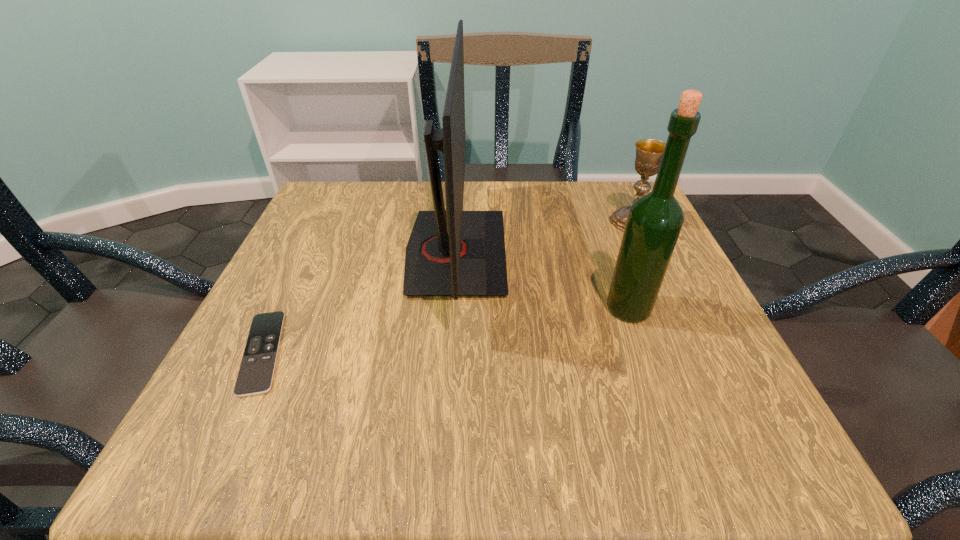
Choose which object is the nearest neighbor to the second object from left to right. Please provide its 2D coordinates. Your answer should be formatted as a tuple, i.e. [(x, y)], where the tuple contains the x and y coordinates of a point satisfying the conditions above.

[(255, 376)]

Point out which object is positioned as the second nearest to the shortest object. Please provide its 2D coordinates. Your answer should be formatted as a tuple, i.e. [(x, y)], where the tuple contains the x and y coordinates of a point satisfying the conditions above.

[(654, 222)]

Locate an element on the screen. The image size is (960, 540). vacant space that satisfies the following two spatial constraints: 1. on the screen side of the liquor; 2. on the left side of the third object from right to left is located at coordinates (452, 308).

In order to click on free space that satisfies the following two spatial constraints: 1. on the screen side of the second object from left to right; 2. on the right side of the liquor in this screenshot , I will do `click(452, 308)`.

The height and width of the screenshot is (540, 960). Identify the location of free space that satisfies the following two spatial constraints: 1. on the front side of the second shortest object; 2. on the screen side of the monitor. click(x=648, y=253).